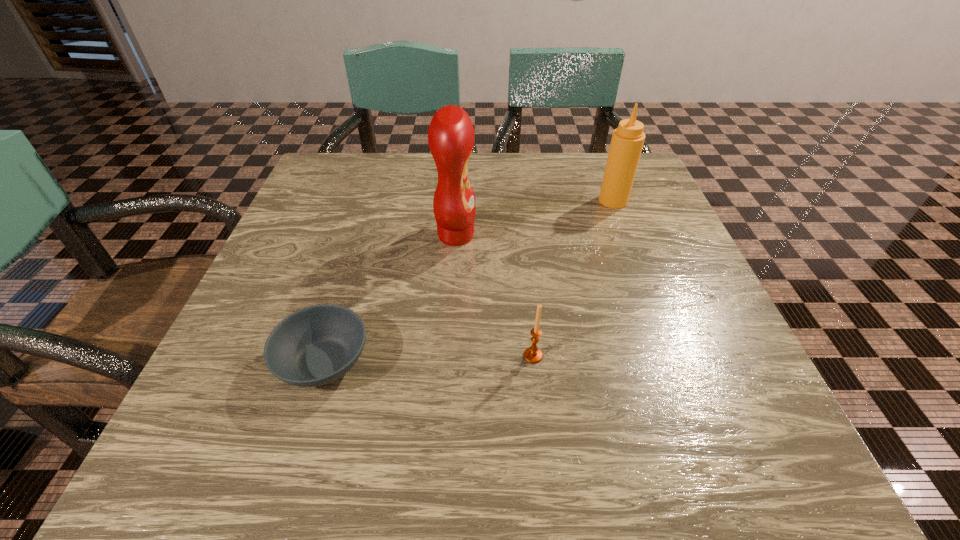
The image size is (960, 540). I want to click on vacant region at the far left corner of the desktop, so click(324, 187).

Where is `free space at the near left corner of the desktop`? free space at the near left corner of the desktop is located at coordinates (190, 431).

Where is `vacant space at the near right corner of the desktop`? The height and width of the screenshot is (540, 960). vacant space at the near right corner of the desktop is located at coordinates (774, 461).

Locate an element on the screen. free space between the third tallest object and the leftmost object is located at coordinates (428, 359).

This screenshot has height=540, width=960. I want to click on free spot between the candle_holder and the farthest object, so click(573, 278).

Locate an element on the screen. vacant point located between the shorter condiment and the third tallest object is located at coordinates (573, 278).

This screenshot has height=540, width=960. In order to click on vacant area that lies between the nearer condiment and the rightmost object in this screenshot , I will do `click(535, 218)`.

Locate an element on the screen. The height and width of the screenshot is (540, 960). vacant region between the third object from left to right and the leftmost object is located at coordinates (428, 359).

This screenshot has width=960, height=540. Find the location of `blank region between the candle_holder and the rightmost object`. blank region between the candle_holder and the rightmost object is located at coordinates (573, 278).

Image resolution: width=960 pixels, height=540 pixels. Find the location of `empty space between the second shortest object and the third shortest object`. empty space between the second shortest object and the third shortest object is located at coordinates (573, 278).